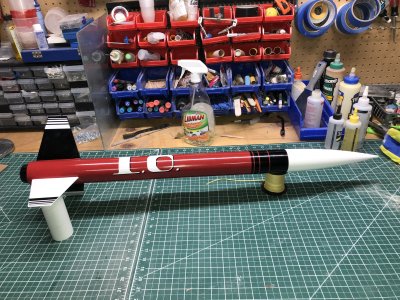
Where is `divider`? The height and width of the screenshot is (300, 400). divider is located at coordinates (88, 60).